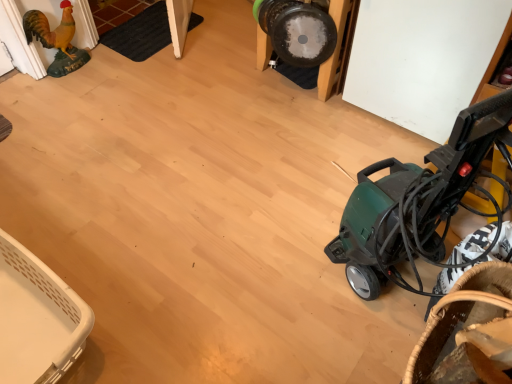
Where is `green plastic vacuum cleaner at right`? This screenshot has height=384, width=512. green plastic vacuum cleaner at right is located at coordinates (418, 201).

The width and height of the screenshot is (512, 384). In order to click on white plastic basket at lower left, which is counted as the first basket, starting from the left in this screenshot , I will do `click(37, 318)`.

Looking at this image, which is behind, brown woven basket at lower right, placed as the second basket when sorted from back to front, or green plastic vacuum cleaner at right?

brown woven basket at lower right, placed as the second basket when sorted from back to front, is further away from the camera.

Does point (485, 265) appear closer or farther from the camera than point (372, 280)?

Point (485, 265).

Based on their sizes in the image, would you say brown woven basket at lower right, arranged as the 1th basket when viewed from the front, is bigger or smaller than green plastic vacuum cleaner at right?

Considering their sizes, brown woven basket at lower right, arranged as the 1th basket when viewed from the front, takes up less space than green plastic vacuum cleaner at right.

Is brown woven basket at lower right, placed as the second basket when sorted from back to front, inside or outside of green plastic vacuum cleaner at right?

The correct answer is: outside.

Is green plastic vacuum cleaner at right taller or shorter than brown woven basket at lower right, placed as the second basket when sorted from back to front?

Considering their sizes, green plastic vacuum cleaner at right has more height than brown woven basket at lower right, placed as the second basket when sorted from back to front.

From the image's perspective, is green plastic vacuum cleaner at right on brown woven basket at lower right, positioned as the second basket in left-to-right order?

Indeed, from the image's perspective, green plastic vacuum cleaner at right is shown above brown woven basket at lower right, positioned as the second basket in left-to-right order.

Based on the photo, relative to brown woven basket at lower right, positioned as the second basket in left-to-right order, is green plastic vacuum cleaner at right in front or behind?

green plastic vacuum cleaner at right is in front of brown woven basket at lower right, positioned as the second basket in left-to-right order.

From the picture: Considering the positions of objects green plastic vacuum cleaner at right and brown woven basket at lower right, placed as the 1th basket when sorted from right to left, in the image provided, who is more to the left, green plastic vacuum cleaner at right or brown woven basket at lower right, placed as the 1th basket when sorted from right to left,?

Positioned to the left is green plastic vacuum cleaner at right.

How far apart are brown woven basket at lower right, placed as the 1th basket when sorted from right to left, and golden matte chicken at left?

brown woven basket at lower right, placed as the 1th basket when sorted from right to left, and golden matte chicken at left are 2.16 meters apart.

From the image's perspective, which one is positioned lower, brown woven basket at lower right, positioned as the second basket in left-to-right order, or golden matte chicken at left?

brown woven basket at lower right, positioned as the second basket in left-to-right order, is shown below in the image.

Looking at this image, considering the relative sizes of brown woven basket at lower right, positioned as the second basket in left-to-right order, and golden matte chicken at left in the image provided, is brown woven basket at lower right, positioned as the second basket in left-to-right order, thinner than golden matte chicken at left?

In fact, brown woven basket at lower right, positioned as the second basket in left-to-right order, might be wider than golden matte chicken at left.

Is the surface of brown woven basket at lower right, positioned as the second basket in left-to-right order, in direct contact with golden matte chicken at left?

No.

Does golden matte chicken at left have a lesser width compared to green plastic vacuum cleaner at right?

Yes.

The image size is (512, 384). I want to click on chicken on the left of green plastic vacuum cleaner at right, so click(52, 31).

In the scene shown: Is green plastic vacuum cleaner at right surrounded by golden matte chicken at left?

No, green plastic vacuum cleaner at right is not surrounded by golden matte chicken at left.

From a real-world perspective, which object rests below the other?

golden matte chicken at left is physically lower.

At what (x,y) coordinates should I click in order to perform the action: click on the 1st basket counting from the right of the golden matte chicken at left. Please return your answer as a coordinate pair (x, y). The image size is (512, 384). Looking at the image, I should click on (37, 318).

Considering the positions of points (27, 34) and (80, 329), is point (27, 34) farther from camera compared to point (80, 329)?

Yes.

Does golden matte chicken at left have a lesser height compared to white plastic basket at lower left, which is counted as the first basket, starting from the left?

No, golden matte chicken at left is not shorter than white plastic basket at lower left, which is counted as the first basket, starting from the left.

From a real-world perspective, is golden matte chicken at left below brown woven basket at lower right, positioned as the second basket in left-to-right order?

Yes.

Considering the relative positions of golden matte chicken at left and brown woven basket at lower right, positioned as the second basket in left-to-right order, in the image provided, is golden matte chicken at left to the left of brown woven basket at lower right, positioned as the second basket in left-to-right order, from the viewer's perspective?

Yes.

Is golden matte chicken at left inside the boundaries of brown woven basket at lower right, arranged as the 1th basket when viewed from the front, or outside?

golden matte chicken at left lies outside brown woven basket at lower right, arranged as the 1th basket when viewed from the front.

Does golden matte chicken at left have a lesser width compared to brown woven basket at lower right, arranged as the 1th basket when viewed from the front?

Yes, golden matte chicken at left is thinner than brown woven basket at lower right, arranged as the 1th basket when viewed from the front.

Is white plastic basket at lower left, the second basket in the front-to-back sequence, surrounding brown woven basket at lower right, placed as the second basket when sorted from back to front?

No, brown woven basket at lower right, placed as the second basket when sorted from back to front, is not a part of white plastic basket at lower left, the second basket in the front-to-back sequence.

Who is bigger, white plastic basket at lower left, which is counted as the first basket, starting from the left, or brown woven basket at lower right, placed as the 1th basket when sorted from right to left?

white plastic basket at lower left, which is counted as the first basket, starting from the left.

Considering the relative sizes of white plastic basket at lower left, which is counted as the first basket, starting from the left, and brown woven basket at lower right, placed as the second basket when sorted from back to front, in the image provided, is white plastic basket at lower left, which is counted as the first basket, starting from the left, thinner than brown woven basket at lower right, placed as the second basket when sorted from back to front,?

Incorrect, the width of white plastic basket at lower left, which is counted as the first basket, starting from the left, is not less than that of brown woven basket at lower right, placed as the second basket when sorted from back to front.

Identify the location of baby carriage below the brown woven basket at lower right, placed as the 1th basket when sorted from right to left (from a real-world perspective). The height and width of the screenshot is (384, 512). (418, 201).

You are a GUI agent. You are given a task and a screenshot of the screen. Output one action in this format:
    pyautogui.click(x=<x>, y=<y>)
    Task: Click on the basket on the right of green plastic vacuum cleaner at right
    Image resolution: width=512 pixels, height=384 pixels.
    Given the screenshot: What is the action you would take?
    pyautogui.click(x=458, y=311)

Considering their positions, is green plastic vacuum cleaner at right positioned closer to golden matte chicken at left than brown woven basket at lower right, placed as the second basket when sorted from back to front?

green plastic vacuum cleaner at right is positioned closer to the anchor golden matte chicken at left.

Considering their positions, is white plastic basket at lower left, which is counted as the first basket, starting from the left, positioned closer to golden matte chicken at left than green plastic vacuum cleaner at right?

Based on the image, white plastic basket at lower left, which is counted as the first basket, starting from the left, appears to be nearer to golden matte chicken at left.

When comparing their distances from white plastic basket at lower left, the second basket when ordered from right to left, does brown woven basket at lower right, positioned as the second basket in left-to-right order, or golden matte chicken at left seem closer?

brown woven basket at lower right, positioned as the second basket in left-to-right order, is positioned closer to the anchor white plastic basket at lower left, the second basket when ordered from right to left.

From the image, which object appears to be farther from green plastic vacuum cleaner at right, golden matte chicken at left or white plastic basket at lower left, which is counted as the first basket, starting from the left?

Based on the image, golden matte chicken at left appears to be further to green plastic vacuum cleaner at right.

When comparing their distances from green plastic vacuum cleaner at right, does white plastic basket at lower left, the second basket in the front-to-back sequence, or golden matte chicken at left seem further?

golden matte chicken at left lies further to green plastic vacuum cleaner at right than the other object.

From the image, which object appears to be nearer to white plastic basket at lower left, the second basket in the front-to-back sequence, golden matte chicken at left or brown woven basket at lower right, placed as the second basket when sorted from back to front?

Based on the image, brown woven basket at lower right, placed as the second basket when sorted from back to front, appears to be nearer to white plastic basket at lower left, the second basket in the front-to-back sequence.

Looking at the image, which one is located further to green plastic vacuum cleaner at right, white plastic basket at lower left, the second basket when ordered from right to left, or brown woven basket at lower right, placed as the second basket when sorted from back to front?

The object further to green plastic vacuum cleaner at right is white plastic basket at lower left, the second basket when ordered from right to left.

Which object lies further to the anchor point white plastic basket at lower left, the 1th basket in the back-to-front sequence, golden matte chicken at left or green plastic vacuum cleaner at right?

The object further to white plastic basket at lower left, the 1th basket in the back-to-front sequence, is golden matte chicken at left.

At what (x,y) coordinates should I click in order to perform the action: click on basket located between golden matte chicken at left and green plastic vacuum cleaner at right in the left-right direction. Please return your answer as a coordinate pair (x, y). The height and width of the screenshot is (384, 512). Looking at the image, I should click on (37, 318).

Find the location of a particular element. The width and height of the screenshot is (512, 384). basket between golden matte chicken at left and brown woven basket at lower right, arranged as the 1th basket when viewed from the front is located at coordinates (37, 318).

Find the location of a particular element. This screenshot has width=512, height=384. baby carriage situated between golden matte chicken at left and brown woven basket at lower right, placed as the second basket when sorted from back to front, from left to right is located at coordinates (418, 201).

Where is `baby carriage situated between white plastic basket at lower left, the 1th basket in the back-to-front sequence, and brown woven basket at lower right, arranged as the 1th basket when viewed from the front, from left to right`? baby carriage situated between white plastic basket at lower left, the 1th basket in the back-to-front sequence, and brown woven basket at lower right, arranged as the 1th basket when viewed from the front, from left to right is located at coordinates (x=418, y=201).